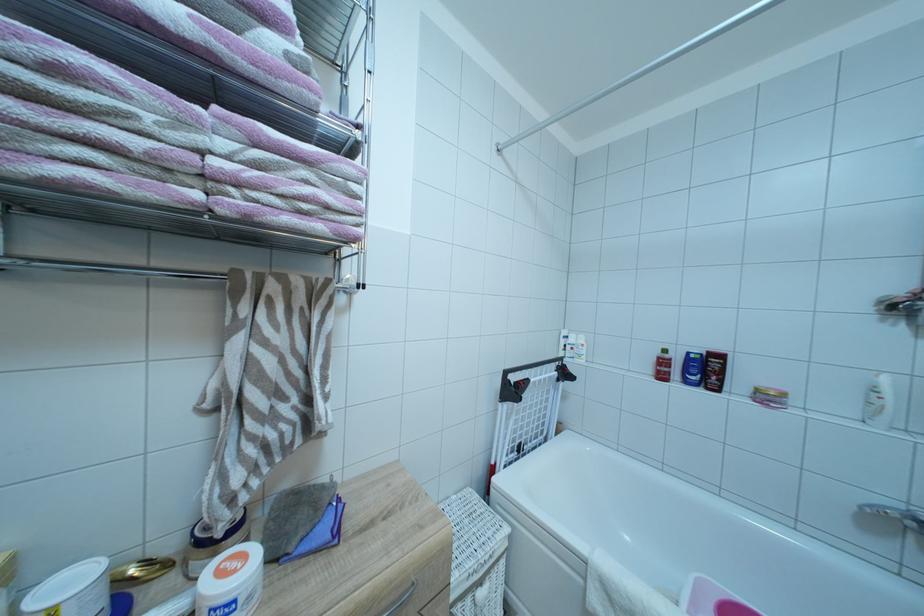
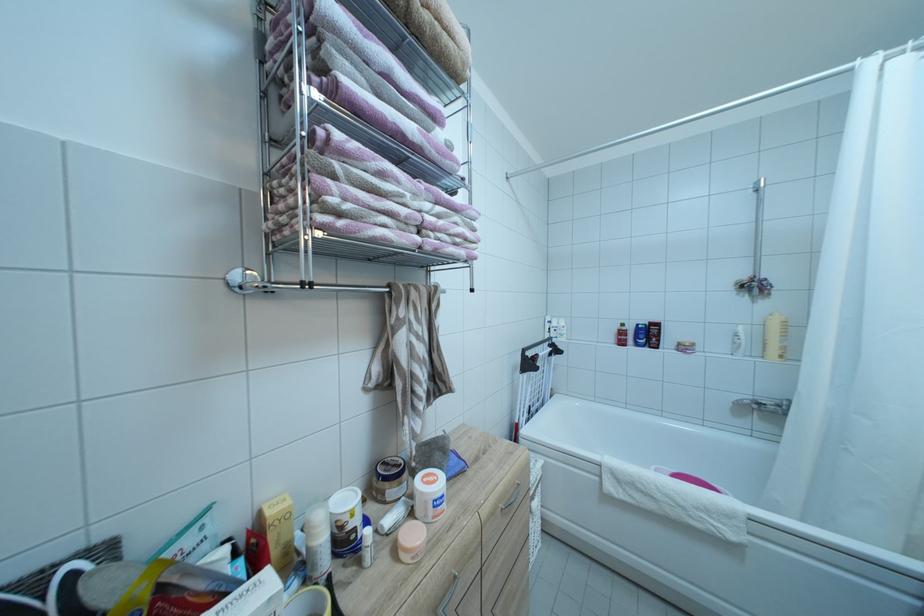
Question: How did the camera likely rotate?

Choices:
 (A) Left
 (B) Right
 (C) Up
 (D) Down

Answer: (B)